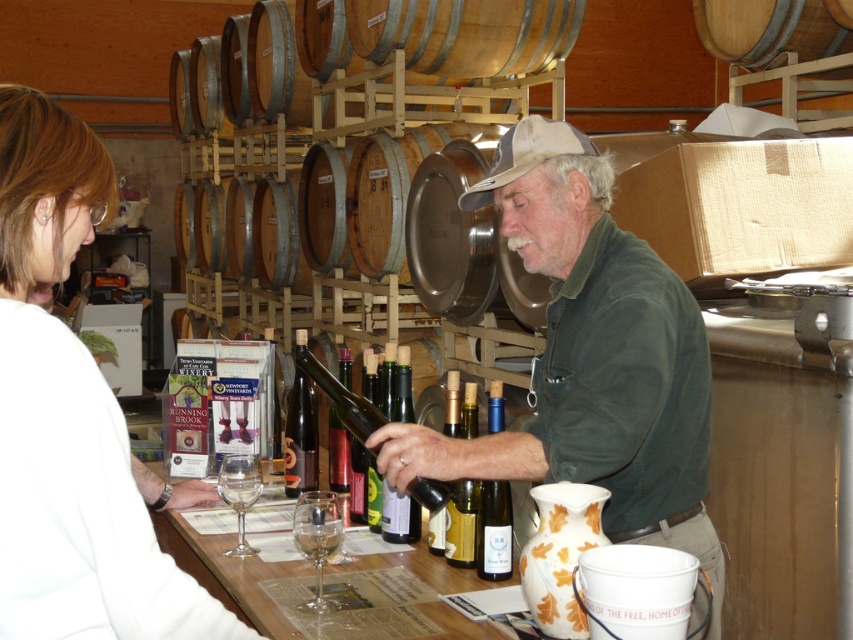
Based on the photo, does shiny dark glass bottle at center lie in front of clear glass at lower center?

No, it is behind clear glass at lower center.

Looking at this image, who is more distant from viewer, (345,400) or (312,534)?

Point (345,400)

Locate an element on the screen. The image size is (853, 640). shiny dark glass bottle at center is located at coordinates (341, 397).

Can you confirm if clear glass wine glass at center is shorter than green matte bottle at center?

Indeed, clear glass wine glass at center has a lesser height compared to green matte bottle at center.

Which is above, clear glass wine glass at center or green matte bottle at center?

green matte bottle at center is above.

Does point (321, 497) come in front of point (383, 525)?

Yes, it is in front of point (383, 525).

Find the location of `clear glass wine glass at center`. clear glass wine glass at center is located at coordinates (317, 538).

Measure the distance between point (294,369) and camera.

Point (294,369) is 8.00 feet away from camera.

Who is more distant from viewer, [288,477] or [347,476]?

Point [347,476]

Is point (296, 388) more distant than point (345, 429)?

Yes, it is.

What are the coordinates of `translucent amber glass bottle at center` in the screenshot? It's located at (300, 438).